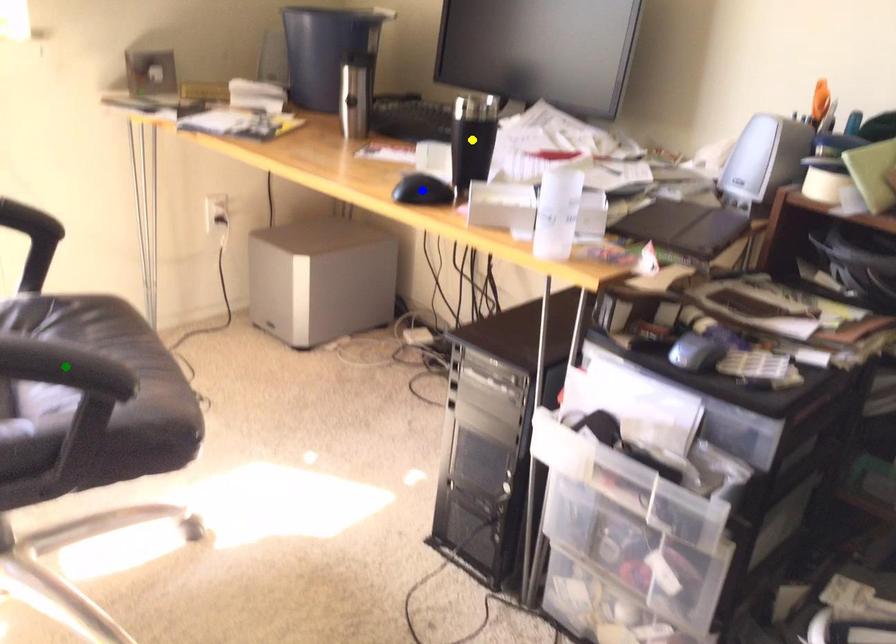
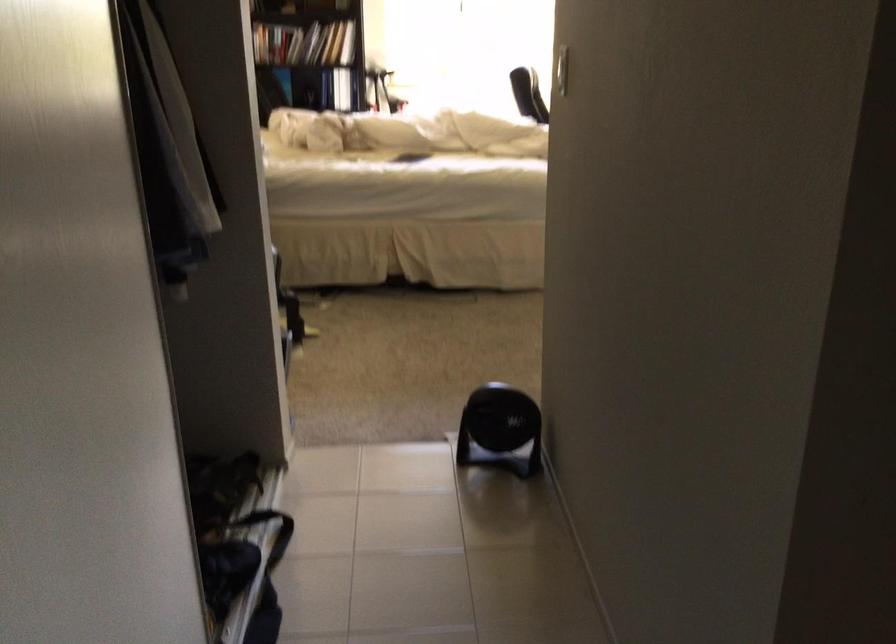
I am providing you with two images of the same scene from different viewpoints. Three points are marked in image1. Which point corresponds to a part or object that is occluded in image2?In image1, three points are marked. Which of them correspond to a part or object that is occluded in image2?Among the three points shown in image1, which one corresponds to a part or object that is no longer visible due to occlusion in image2?

yellow point, green point, blue point